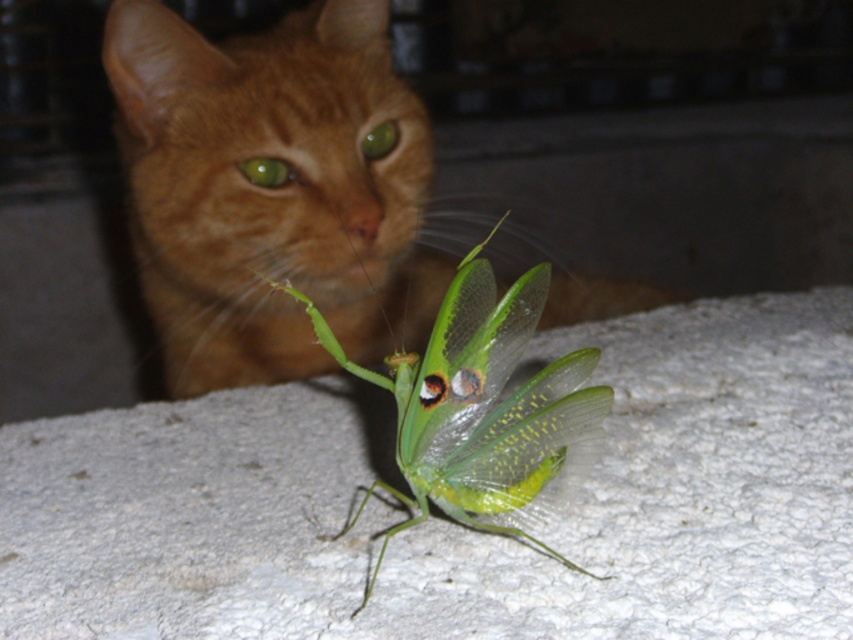
You are a photographer who wants to capture a closeup of both the orange fur cat at upper center and the green translucent mantis at center. Given their sizes, will the mantis be easier to focus on than the cat?

The orange fur cat at upper center is larger in size than the green translucent mantis at center, so the cat will be easier to focus on due to its larger size.

You are a photographer trying to capture a close shot of the green translucent mantis at center. However, the orange fur cat at upper center is blocking your view. Can you move the cat to the side so you can get a clear shot of the mantis?

The orange fur cat at upper center is located above the green translucent mantis at center, so if you move the cat downward, you can get a clear shot of the mantis.